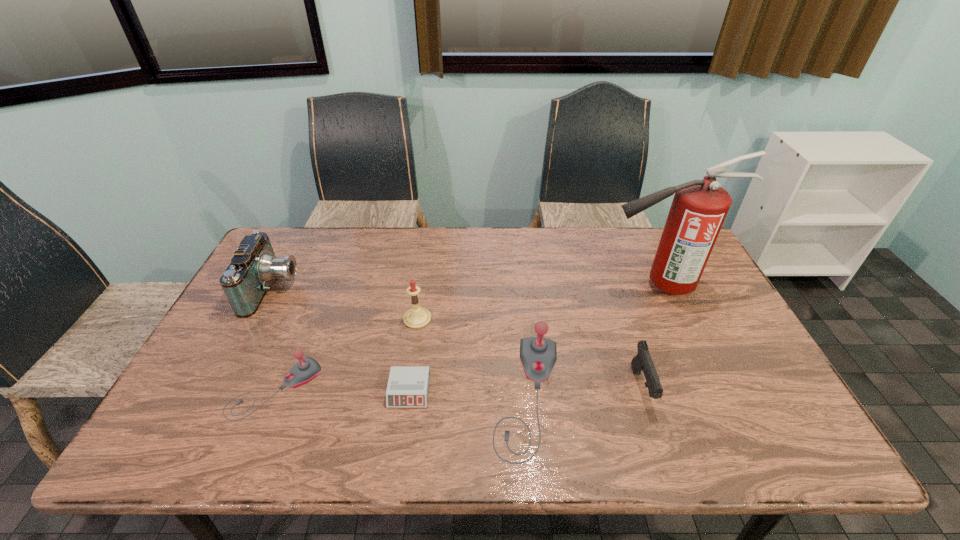
The height and width of the screenshot is (540, 960). Identify the location of joystick that is at the left edge. (304, 371).

Identify the location of camcorder that is positioned at the left edge. (254, 266).

Identify the location of object that is at the right edge. (699, 207).

Locate an element on the screen. This screenshot has width=960, height=540. object located in the far left corner section of the desktop is located at coordinates (254, 266).

In order to click on object at the near left corner in this screenshot , I will do `click(304, 371)`.

Find the location of a particular element. free space at the far edge of the desktop is located at coordinates (325, 258).

Image resolution: width=960 pixels, height=540 pixels. I want to click on vacant space at the near edge of the desktop, so coord(692,400).

The height and width of the screenshot is (540, 960). In the image, there is a desktop. In order to click on vacant space at the left edge in this screenshot , I will do `click(219, 358)`.

In the image, there is a desktop. Where is `free region at the right edge`? The image size is (960, 540). free region at the right edge is located at coordinates (683, 304).

Where is `free location at the far left corner`? The image size is (960, 540). free location at the far left corner is located at coordinates (298, 256).